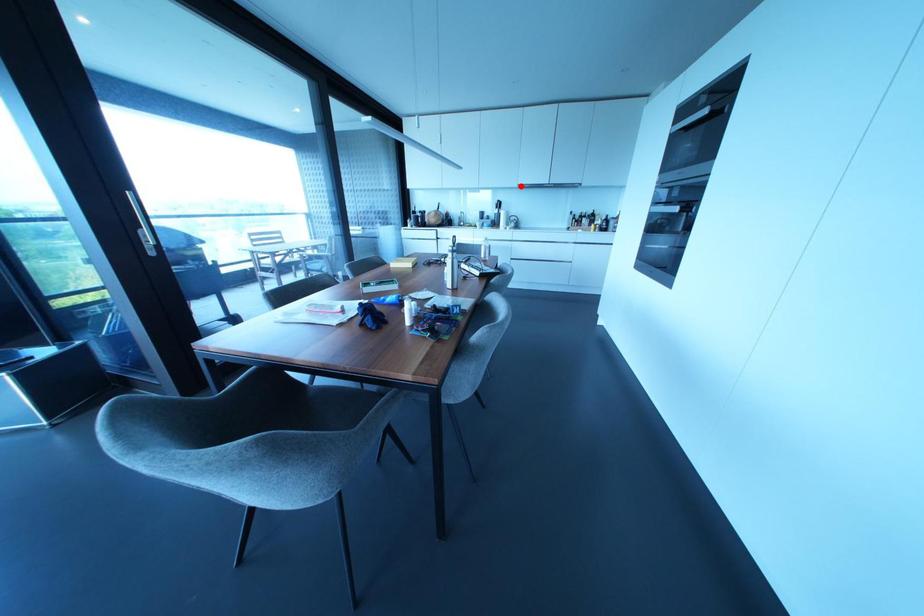
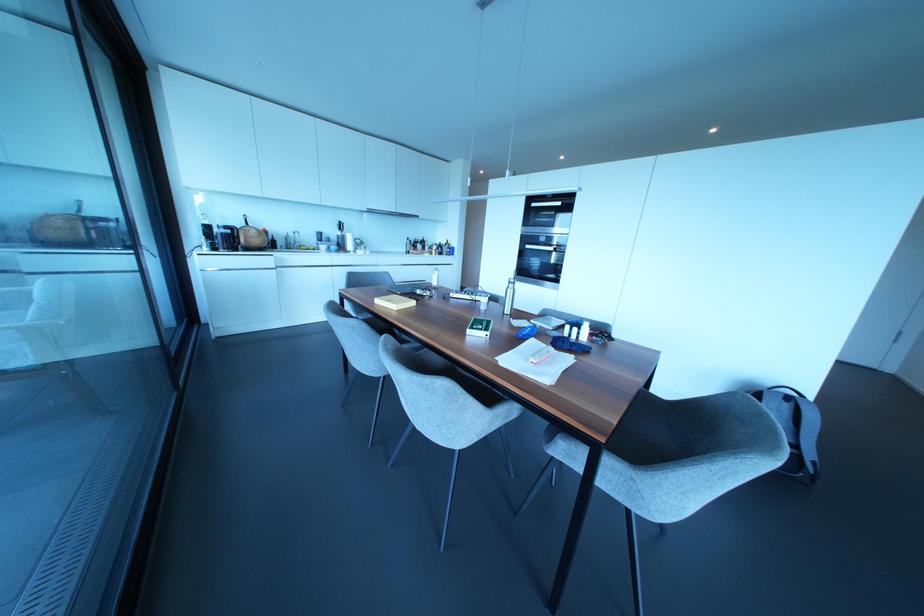
In the second image, find the point that corresponds to the highlighted location in the first image.

(370, 209)